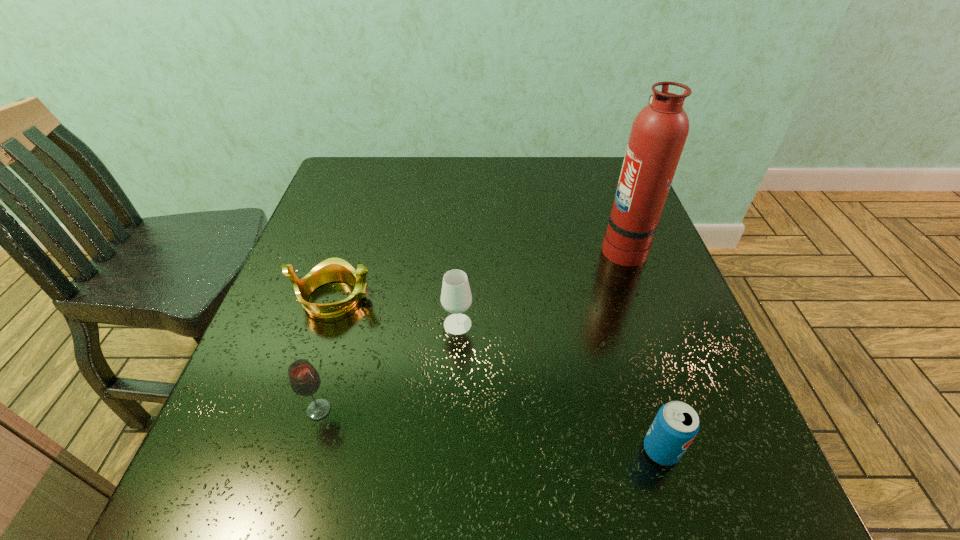
Locate an element on the screen. object located in the near right corner section of the desktop is located at coordinates (676, 424).

Where is `free region at the far edge`? The width and height of the screenshot is (960, 540). free region at the far edge is located at coordinates (469, 194).

Find the location of a particular element. Image resolution: width=960 pixels, height=540 pixels. free space at the near edge of the desktop is located at coordinates (518, 489).

Identify the location of vacant area at the left edge. The height and width of the screenshot is (540, 960). (369, 214).

This screenshot has height=540, width=960. In the image, there is a desktop. What are the coordinates of `vacant space at the right edge` in the screenshot? It's located at (648, 271).

Where is `vacant region at the near left corner of the desktop`? This screenshot has width=960, height=540. vacant region at the near left corner of the desktop is located at coordinates 275,489.

The height and width of the screenshot is (540, 960). In the image, there is a desktop. Identify the location of vacant area at the far right corner. 591,183.

The width and height of the screenshot is (960, 540). What are the coordinates of `vacant area that lies between the left glass drink container and the fire extinguisher` in the screenshot? It's located at (471, 328).

Identify the location of free area in between the nearest object and the farther glass drink container. This screenshot has width=960, height=540. (560, 387).

At what (x,y) coordinates should I click in order to perform the action: click on free space between the tiara and the right glass drink container. Please return your answer as a coordinate pair (x, y). Looking at the image, I should click on (396, 311).